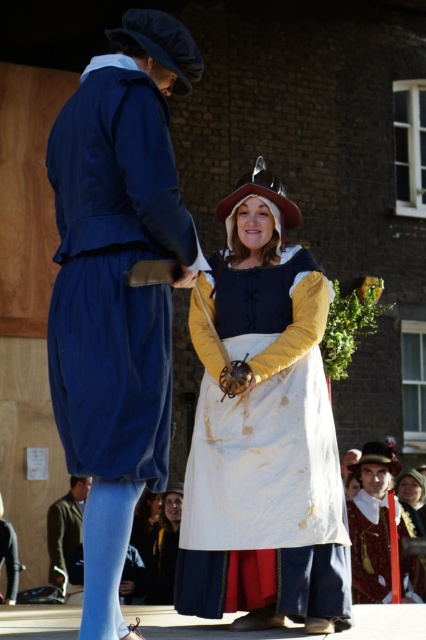
Does matte yellow fabric dress at center appear on the right side of white cotton apron at center?

Correct, you'll find matte yellow fabric dress at center to the right of white cotton apron at center.

Between point (325, 288) and point (175, 548), which one is positioned in front?

Point (325, 288)

Who is more forward, (282, 339) or (164, 550)?

Point (282, 339)

Find the location of a particular element. matte yellow fabric dress at center is located at coordinates (264, 433).

Does white cotton apron at center appear on the left side of smooth brown leather hat at upper center?

Indeed, white cotton apron at center is positioned on the left side of smooth brown leather hat at upper center.

Who is more forward, (158, 570) or (351, 461)?

Point (158, 570) is in front.

I want to click on white cotton apron at center, so click(166, 548).

This screenshot has height=640, width=426. Describe the element at coordinates (66, 525) in the screenshot. I see `green fabric jacket at lower left` at that location.

Can you confirm if green fabric jacket at lower left is bigger than white cotton apron at center?

Indeed, green fabric jacket at lower left has a larger size compared to white cotton apron at center.

This screenshot has height=640, width=426. Find the location of `green fabric jacket at lower left`. green fabric jacket at lower left is located at coordinates tap(66, 525).